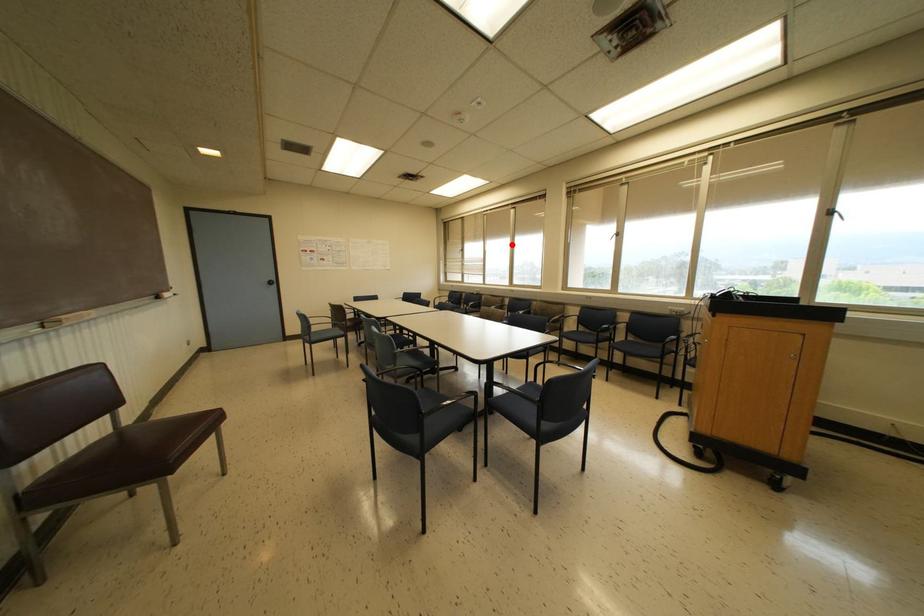
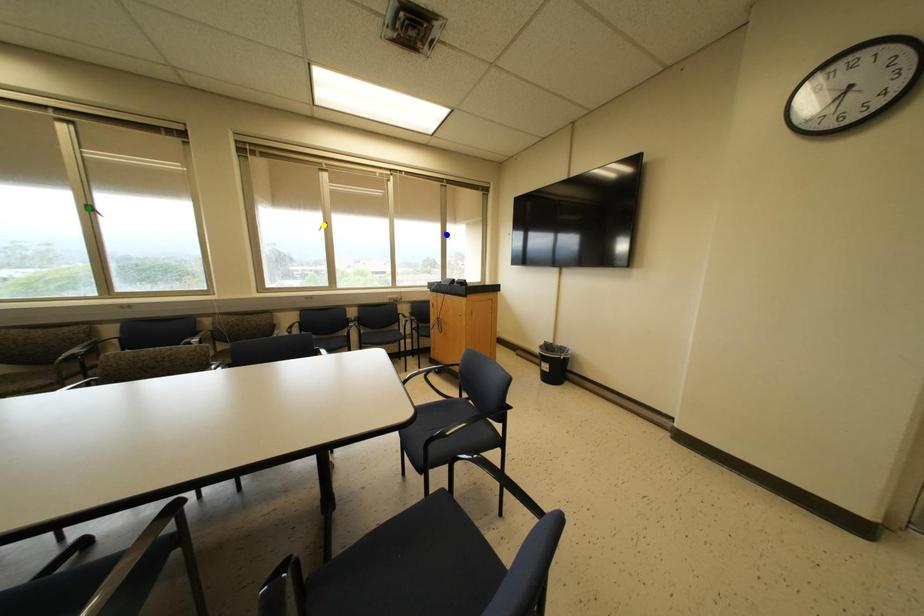
Question: I am providing you with two images of the same scene from different viewpoints. A red point is marked on the first image. You are given multiple points on the second image. In image 2, which mark is for the same physical point as the one in image 1?

Choices:
 (A) blue point
 (B) yellow point
 (C) green point

Answer: (C)